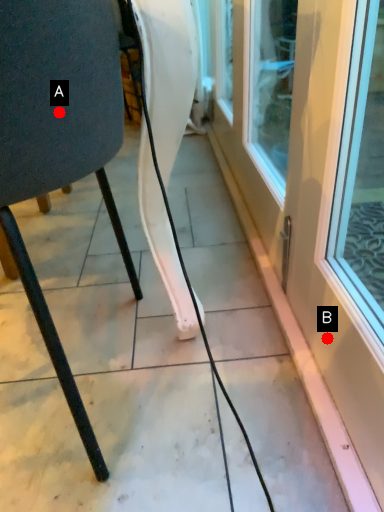
Question: Two points are circled on the image, labeled by A and B beside each circle. Among these points, which one is nearest to the camera?

Choices:
 (A) A is closer
 (B) B is closer

Answer: (A)